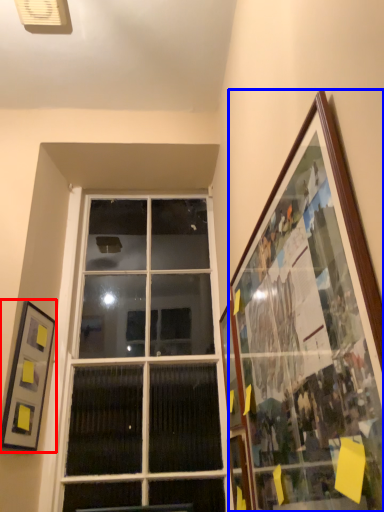
Question: Which of the following is the closest to the observer, picture frame (highlighted by a red box) or picture frame (highlighted by a blue box)?

Choices:
 (A) picture frame
 (B) picture frame

Answer: (B)